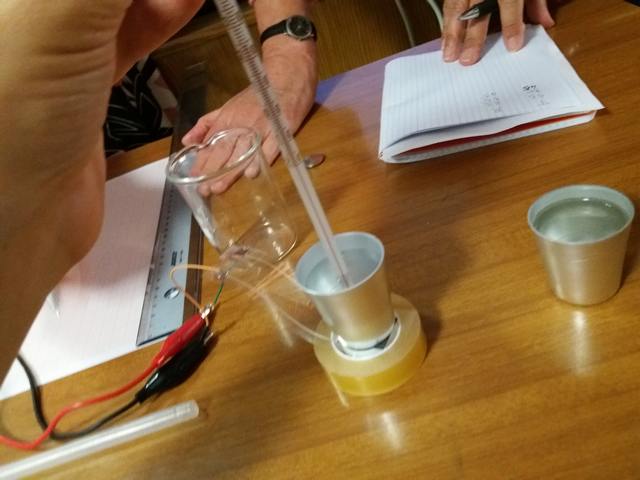
Identify the location of ruler for measuring. (173, 250).